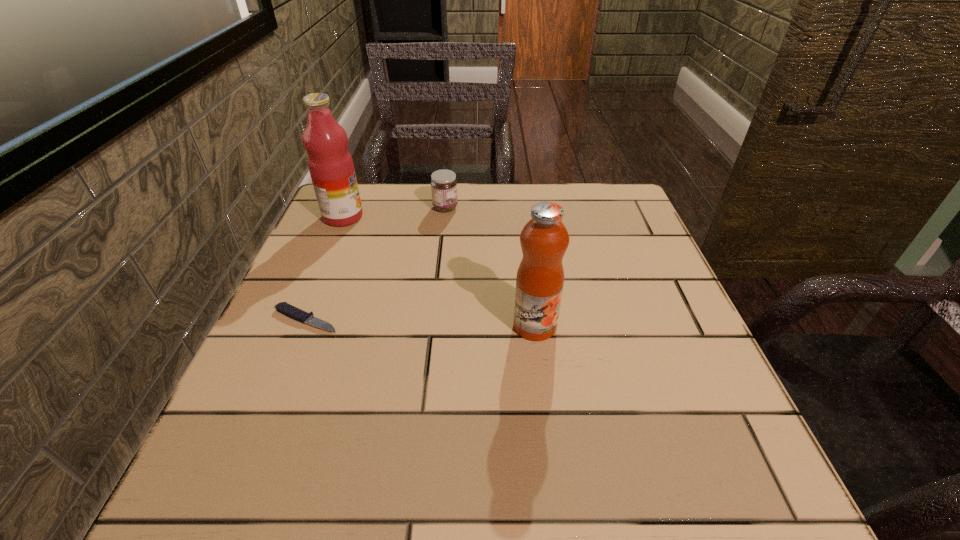
I want to click on free space at the far right corner of the desktop, so click(x=614, y=188).

You are a GUI agent. You are given a task and a screenshot of the screen. Output one action in this format:
    pyautogui.click(x=<x>, y=<y>)
    Task: Click on the vacant space at the near right corner
    Image resolution: width=960 pixels, height=540 pixels.
    Given the screenshot: What is the action you would take?
    pyautogui.click(x=651, y=501)

Identify the location of blank region between the right fruit juice and the left fruit juice. pos(439,271).

At what (x,y) coordinates should I click in order to perform the action: click on unoccupied position between the rightmost object and the second object from right to left. Please return your answer as a coordinate pair (x, y). Looking at the image, I should click on (491, 267).

At what (x,y) coordinates should I click in order to perform the action: click on empty location between the shorter fruit juice and the farther fruit juice. Please return your answer as a coordinate pair (x, y). The image size is (960, 540). Looking at the image, I should click on (439, 271).

Identify the location of unoccupied position between the right fruit juice and the left fruit juice. (439, 271).

I want to click on unoccupied area between the right fruit juice and the left fruit juice, so click(x=439, y=271).

Where is `vacant space that's between the second object from right to left and the farther fruit juice`? This screenshot has width=960, height=540. vacant space that's between the second object from right to left and the farther fruit juice is located at coordinates (395, 212).

I want to click on free space between the jam and the third shortest object, so click(491, 267).

Where is `free point between the farther fruit juice and the third shortest object`? Image resolution: width=960 pixels, height=540 pixels. free point between the farther fruit juice and the third shortest object is located at coordinates (439, 271).